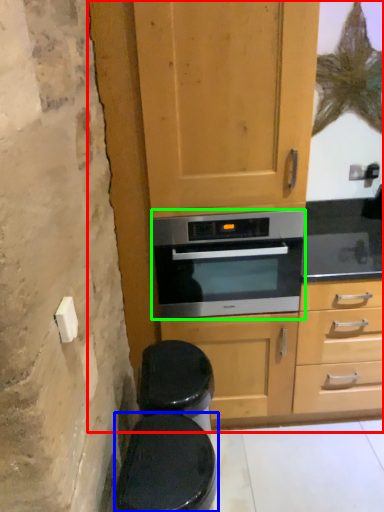
Question: Which object is the farthest from dresser (highlighted by a red box)? Choose among these: toilet bowl (highlighted by a blue box) or oven (highlighted by a green box).

Choices:
 (A) toilet bowl
 (B) oven

Answer: (A)